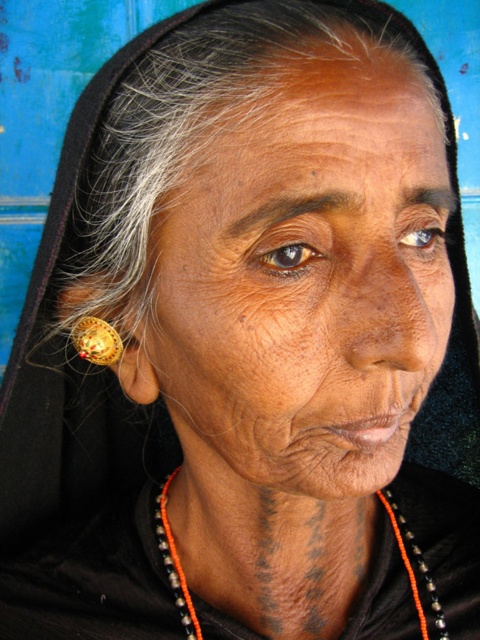
Question: Which of these objects is positioned farthest from the gold metallic earring at left?

Choices:
 (A) orange beaded necklace at lower center
 (B) dry skin at center

Answer: (A)

Question: From the image, what is the correct spatial relationship of dry skin at center in relation to orange beaded necklace at lower center?

Choices:
 (A) above
 (B) below

Answer: (A)

Question: Considering the real-world distances, which object is closest to the gold metallic earring at left?

Choices:
 (A) orange beaded necklace at lower center
 (B) dry skin at center

Answer: (B)

Question: Does dry skin at center come behind orange beaded necklace at lower center?

Choices:
 (A) yes
 (B) no

Answer: (B)

Question: Among these points, which one is farthest from the camera?

Choices:
 (A) (431, 608)
 (B) (299, 445)

Answer: (A)

Question: Can you confirm if orange beaded necklace at lower center is wider than gold metallic earring at left?

Choices:
 (A) no
 (B) yes

Answer: (B)